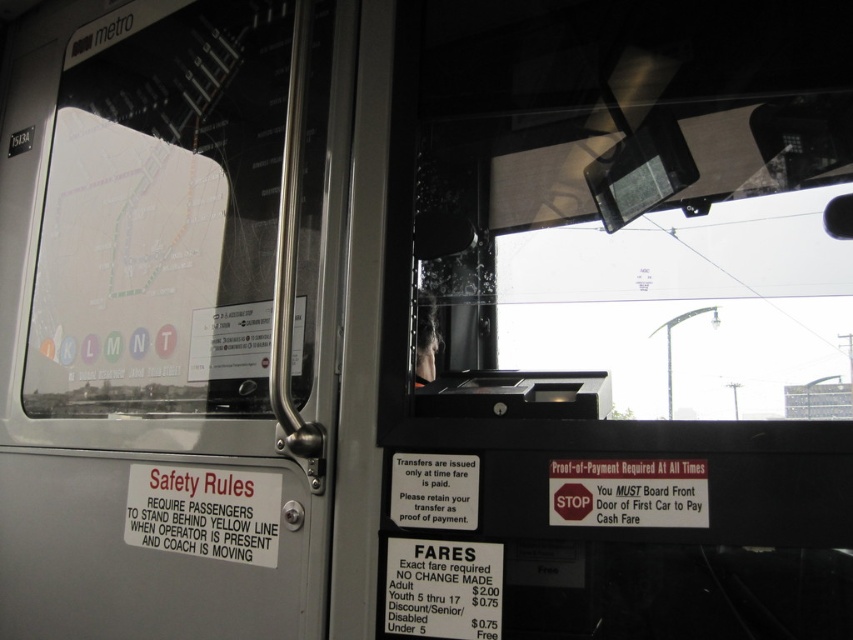
Question: Can you confirm if gray metallic door at left is positioned below transparent glass windshield at center?

Choices:
 (A) no
 (B) yes

Answer: (B)

Question: Which object appears closest to the camera in this image?

Choices:
 (A) transparent glass windshield at center
 (B) gray metallic door at left

Answer: (A)

Question: Is gray metallic door at left above transparent glass windshield at center?

Choices:
 (A) no
 (B) yes

Answer: (A)

Question: Which point appears closest to the camera in this image?

Choices:
 (A) (810, 282)
 (B) (252, 436)

Answer: (A)

Question: Considering the relative positions of gray metallic door at left and transparent glass windshield at center in the image provided, where is gray metallic door at left located with respect to transparent glass windshield at center?

Choices:
 (A) right
 (B) left

Answer: (B)